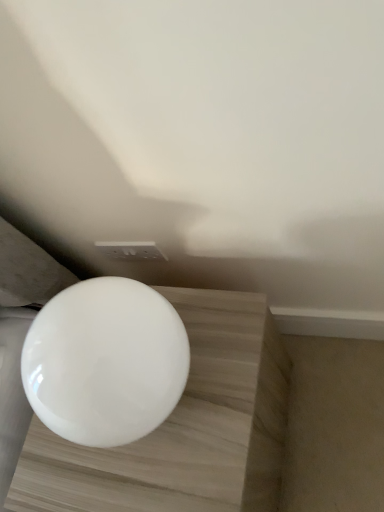
At what (x,y) coordinates should I click in order to perform the action: click on free space in front of white glossy toilet at center. Please return your answer as a coordinate pair (x, y). The width and height of the screenshot is (384, 512). Looking at the image, I should click on (182, 463).